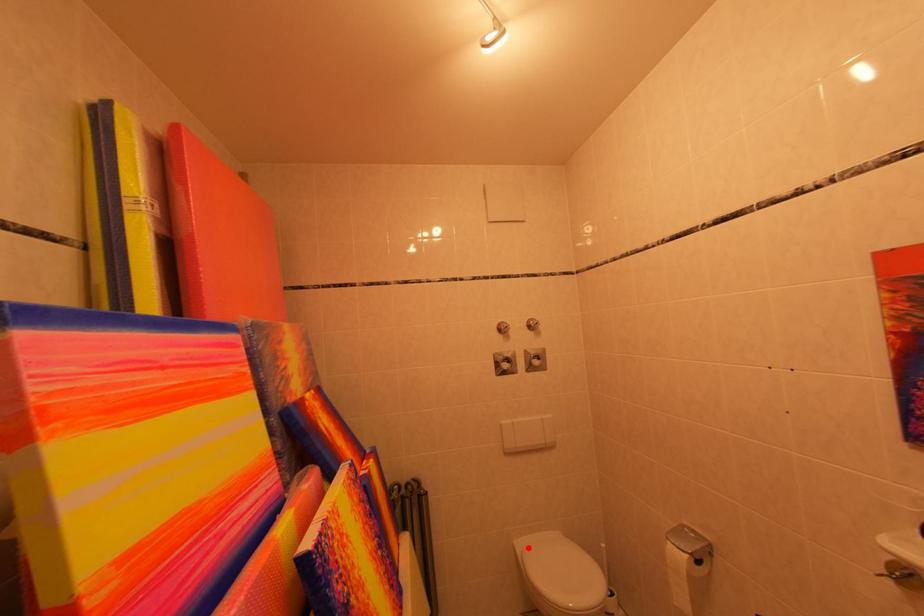
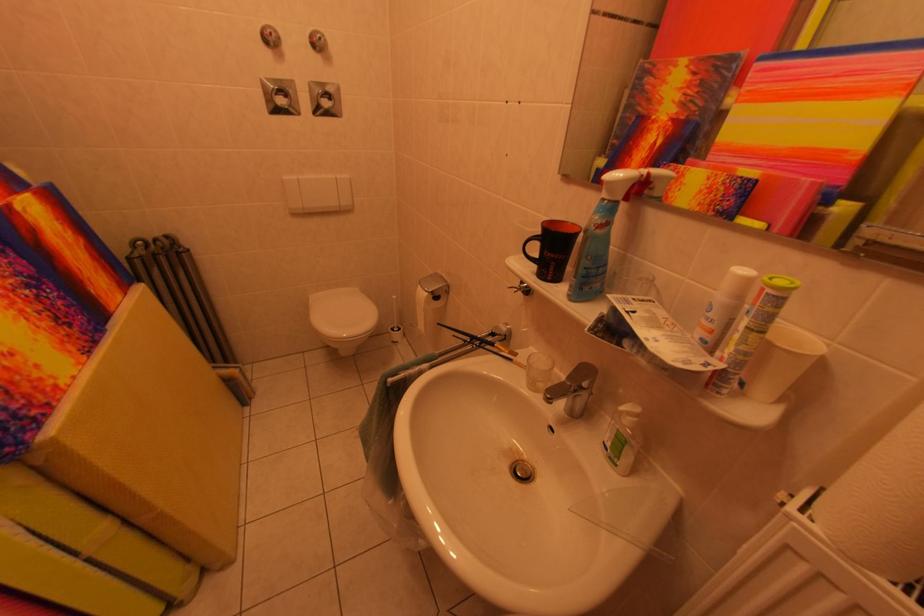
The point at the highlighted location is marked in the first image. Where is the corresponding point in the second image?

(322, 301)